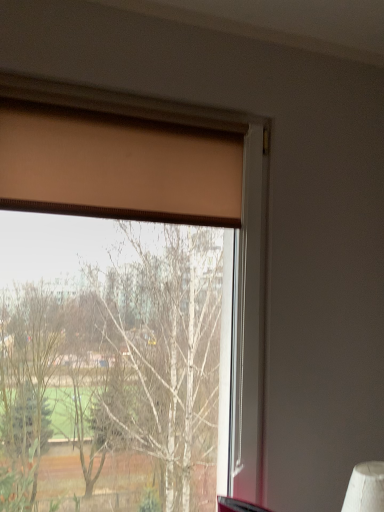
Question: From the image's perspective, relative to matte brown curtain at upper left, is matte brown curtain at upper left above or below?

Choices:
 (A) above
 (B) below

Answer: (B)

Question: Is matte brown curtain at upper left situated inside matte brown curtain at upper left or outside?

Choices:
 (A) inside
 (B) outside

Answer: (B)

Question: Considering the relative positions of matte brown curtain at upper left and matte brown curtain at upper left in the image provided, is matte brown curtain at upper left to the left or to the right of matte brown curtain at upper left?

Choices:
 (A) left
 (B) right

Answer: (B)

Question: Looking at their shapes, would you say matte brown curtain at upper left is wider or thinner than matte brown curtain at upper left?

Choices:
 (A) thin
 (B) wide

Answer: (A)

Question: Does point (183, 178) appear closer or farther from the camera than point (9, 202)?

Choices:
 (A) farther
 (B) closer

Answer: (A)

Question: Is matte brown curtain at upper left bigger or smaller than matte brown curtain at upper left?

Choices:
 (A) small
 (B) big

Answer: (A)

Question: Considering their positions, is matte brown curtain at upper left located in front of or behind matte brown curtain at upper left?

Choices:
 (A) behind
 (B) front

Answer: (A)